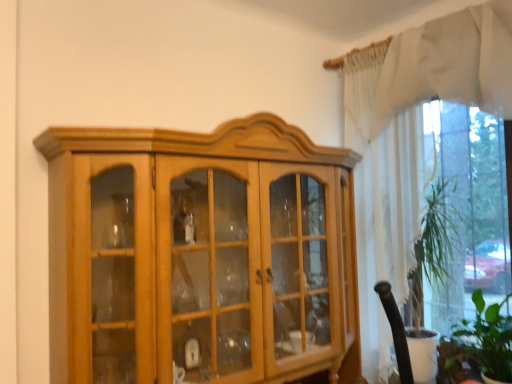
This screenshot has height=384, width=512. In order to click on green leafy plant at lower right in this screenshot , I will do coord(478,346).

Locate an element on the screen. white sheer curtain at upper right, arranged as the second curtain when viewed from the top is located at coordinates (382, 198).

You are a GUI agent. You are given a task and a screenshot of the screen. Output one action in this format:
    pyautogui.click(x=<x>, y=<y>)
    Task: Click on the white sheer curtain at upper right, arranged as the second curtain when ordered from the bottom
    Image resolution: width=512 pixels, height=384 pixels.
    Given the screenshot: What is the action you would take?
    pyautogui.click(x=449, y=64)

Does point (186, 202) come farther from viewer compared to point (481, 292)?

No, (186, 202) is closer to viewer.

Does light brown wood cabinet at center have a greater width compared to green leafy plant at lower right?

Yes, light brown wood cabinet at center is wider than green leafy plant at lower right.

How many degrees apart are the facing directions of light brown wood cabinet at center and green leafy plant at lower right?

The facing directions of light brown wood cabinet at center and green leafy plant at lower right are 91 degrees apart.

How far apart are light brown wood cabinet at center and green leafy plant at lower right?

light brown wood cabinet at center is 3.37 feet away from green leafy plant at lower right.

Does white sheer curtain at upper right, arranged as the second curtain when viewed from the top, turn towards light brown wood cabinet at center?

Yes.

Between white sheer curtain at upper right, arranged as the second curtain when viewed from the top, and light brown wood cabinet at center, which one has smaller size?

With smaller size is white sheer curtain at upper right, arranged as the second curtain when viewed from the top.

Is the depth of white sheer curtain at upper right, arranged as the second curtain when viewed from the top, greater than that of light brown wood cabinet at center?

Yes, it is behind light brown wood cabinet at center.

How much distance is there between green leafy plant at lower right and light brown wood cabinet at center?

1.03 meters.

Considering the points (507, 326) and (346, 381), which point is behind, point (507, 326) or point (346, 381)?

Point (346, 381)

Considering the sizes of objects green leafy plant at lower right and light brown wood cabinet at center in the image provided, who is shorter, green leafy plant at lower right or light brown wood cabinet at center?

green leafy plant at lower right.

From a real-world perspective, which object stands above the other?

white sheer curtain at upper right, which ranks as the first curtain in top-to-bottom order, is physically above.

In terms of width, does white sheer curtain at upper right, arranged as the second curtain when viewed from the top, look wider or thinner when compared to white sheer curtain at upper right, which ranks as the first curtain in top-to-bottom order?

Clearly, white sheer curtain at upper right, arranged as the second curtain when viewed from the top, has more width compared to white sheer curtain at upper right, which ranks as the first curtain in top-to-bottom order.

Would you say white sheer curtain at upper right, arranged as the second curtain when viewed from the top, is a long distance from white sheer curtain at upper right, which ranks as the first curtain in top-to-bottom order?

No, there isn't a large distance between white sheer curtain at upper right, arranged as the second curtain when viewed from the top, and white sheer curtain at upper right, which ranks as the first curtain in top-to-bottom order.

Where is `curtain on the left side of white sheer curtain at upper right, arranged as the second curtain when ordered from the bottom`? This screenshot has width=512, height=384. curtain on the left side of white sheer curtain at upper right, arranged as the second curtain when ordered from the bottom is located at coordinates (382, 198).

Is green leafy plant at lower right wider than white sheer curtain at upper right, arranged as the second curtain when ordered from the bottom?

Yes, green leafy plant at lower right is wider than white sheer curtain at upper right, arranged as the second curtain when ordered from the bottom.

From the image's perspective, is green leafy plant at lower right located above or below white sheer curtain at upper right, which ranks as the first curtain in top-to-bottom order?

Clearly, from the image's perspective, green leafy plant at lower right is below white sheer curtain at upper right, which ranks as the first curtain in top-to-bottom order.

Is green leafy plant at lower right not within white sheer curtain at upper right, which ranks as the first curtain in top-to-bottom order?

Yes, green leafy plant at lower right is not within white sheer curtain at upper right, which ranks as the first curtain in top-to-bottom order.

Can we say white sheer curtain at upper right, which ranks as the first curtain in top-to-bottom order, lies outside white sheer curtain at upper right, arranged as the second curtain when viewed from the top?

No, white sheer curtain at upper right, which ranks as the first curtain in top-to-bottom order, is inside or overlapping with white sheer curtain at upper right, arranged as the second curtain when viewed from the top.

Find the location of `curtain behind the white sheer curtain at upper right, arranged as the second curtain when ordered from the bottom`. curtain behind the white sheer curtain at upper right, arranged as the second curtain when ordered from the bottom is located at coordinates (382, 198).

Considering the positions of objects white sheer curtain at upper right, arranged as the second curtain when ordered from the bottom, and white sheer curtain at upper right, arranged as the 1th curtain when ordered from the bottom, in the image provided, who is more to the right, white sheer curtain at upper right, arranged as the second curtain when ordered from the bottom, or white sheer curtain at upper right, arranged as the 1th curtain when ordered from the bottom,?

white sheer curtain at upper right, arranged as the second curtain when ordered from the bottom.

Is white sheer curtain at upper right, arranged as the second curtain when ordered from the bottom, positioned with its back to white sheer curtain at upper right, arranged as the second curtain when viewed from the top?

Yes, white sheer curtain at upper right, arranged as the second curtain when ordered from the bottom, is positioned with its back facing white sheer curtain at upper right, arranged as the second curtain when viewed from the top.

Is light brown wood cabinet at center not close to white sheer curtain at upper right, arranged as the second curtain when ordered from the bottom?

Actually, light brown wood cabinet at center and white sheer curtain at upper right, arranged as the second curtain when ordered from the bottom, are a little close together.

Can you confirm if light brown wood cabinet at center is taller than white sheer curtain at upper right, which ranks as the first curtain in top-to-bottom order?

Yes.

In terms of size, does light brown wood cabinet at center appear bigger or smaller than white sheer curtain at upper right, arranged as the second curtain when ordered from the bottom?

Considering their sizes, light brown wood cabinet at center takes up more space than white sheer curtain at upper right, arranged as the second curtain when ordered from the bottom.

Is light brown wood cabinet at center at the right side of white sheer curtain at upper right, which ranks as the first curtain in top-to-bottom order?

No, light brown wood cabinet at center is not to the right of white sheer curtain at upper right, which ranks as the first curtain in top-to-bottom order.

Where is `plant below the light brown wood cabinet at center (from a real-world perspective)`? plant below the light brown wood cabinet at center (from a real-world perspective) is located at coordinates (478, 346).

The image size is (512, 384). There is a light brown wood cabinet at center. In order to click on the 1st curtain above it (from the image's perspective) in this screenshot , I will do `click(382, 198)`.

Estimate the real-world distances between objects in this image. Which object is further from light brown wood cabinet at center, white sheer curtain at upper right, arranged as the second curtain when ordered from the bottom, or white sheer curtain at upper right, arranged as the second curtain when viewed from the top?

white sheer curtain at upper right, arranged as the second curtain when ordered from the bottom, is further to light brown wood cabinet at center.

Which object lies further to the anchor point light brown wood cabinet at center, white sheer curtain at upper right, which ranks as the first curtain in top-to-bottom order, or green leafy plant at lower right?

green leafy plant at lower right is further to light brown wood cabinet at center.

Estimate the real-world distances between objects in this image. Which object is further from green leafy plant at lower right, white sheer curtain at upper right, arranged as the 1th curtain when ordered from the bottom, or white sheer curtain at upper right, which ranks as the first curtain in top-to-bottom order?

white sheer curtain at upper right, which ranks as the first curtain in top-to-bottom order, is further to green leafy plant at lower right.

From the image, which object appears to be nearer to light brown wood cabinet at center, white sheer curtain at upper right, arranged as the 1th curtain when ordered from the bottom, or green leafy plant at lower right?

white sheer curtain at upper right, arranged as the 1th curtain when ordered from the bottom, lies closer to light brown wood cabinet at center than the other object.

Considering their positions, is green leafy plant at lower right positioned closer to white sheer curtain at upper right, arranged as the second curtain when viewed from the top, than light brown wood cabinet at center?

green leafy plant at lower right lies closer to white sheer curtain at upper right, arranged as the second curtain when viewed from the top, than the other object.

In the scene shown: When comparing their distances from white sheer curtain at upper right, which ranks as the first curtain in top-to-bottom order, does white sheer curtain at upper right, arranged as the 1th curtain when ordered from the bottom, or green leafy plant at lower right seem closer?

Among the two, white sheer curtain at upper right, arranged as the 1th curtain when ordered from the bottom, is located nearer to white sheer curtain at upper right, which ranks as the first curtain in top-to-bottom order.

Considering their positions, is light brown wood cabinet at center positioned further to white sheer curtain at upper right, arranged as the second curtain when ordered from the bottom, than white sheer curtain at upper right, arranged as the 1th curtain when ordered from the bottom?

light brown wood cabinet at center lies further to white sheer curtain at upper right, arranged as the second curtain when ordered from the bottom, than the other object.

When comparing their distances from light brown wood cabinet at center, does green leafy plant at lower right or white sheer curtain at upper right, arranged as the second curtain when viewed from the top, seem closer?

white sheer curtain at upper right, arranged as the second curtain when viewed from the top, is positioned closer to the anchor light brown wood cabinet at center.

Find the location of a particular element. The image size is (512, 384). curtain between white sheer curtain at upper right, arranged as the second curtain when ordered from the bottom, and green leafy plant at lower right in the up-down direction is located at coordinates (x=382, y=198).

Identify the location of curtain between light brown wood cabinet at center and white sheer curtain at upper right, arranged as the second curtain when ordered from the bottom. (382, 198).